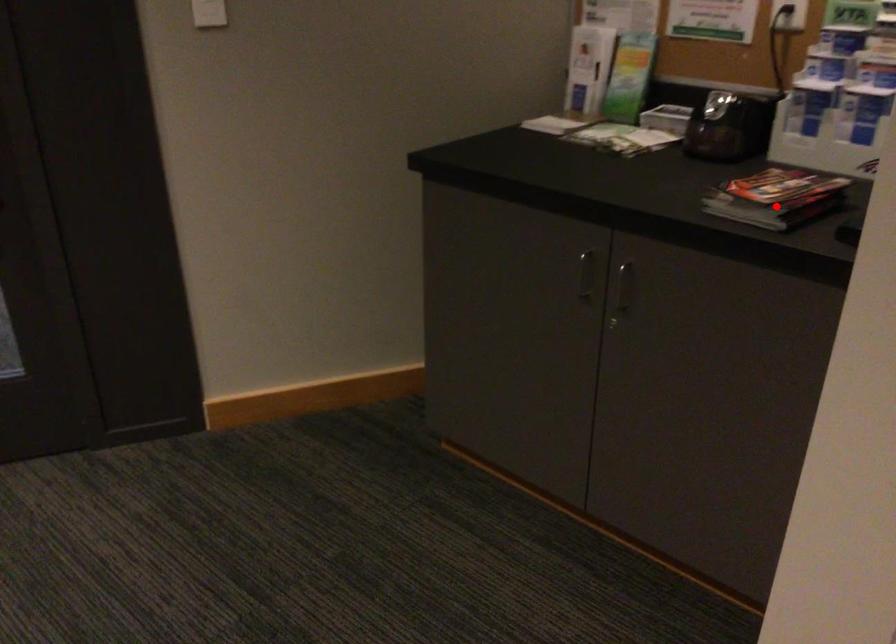
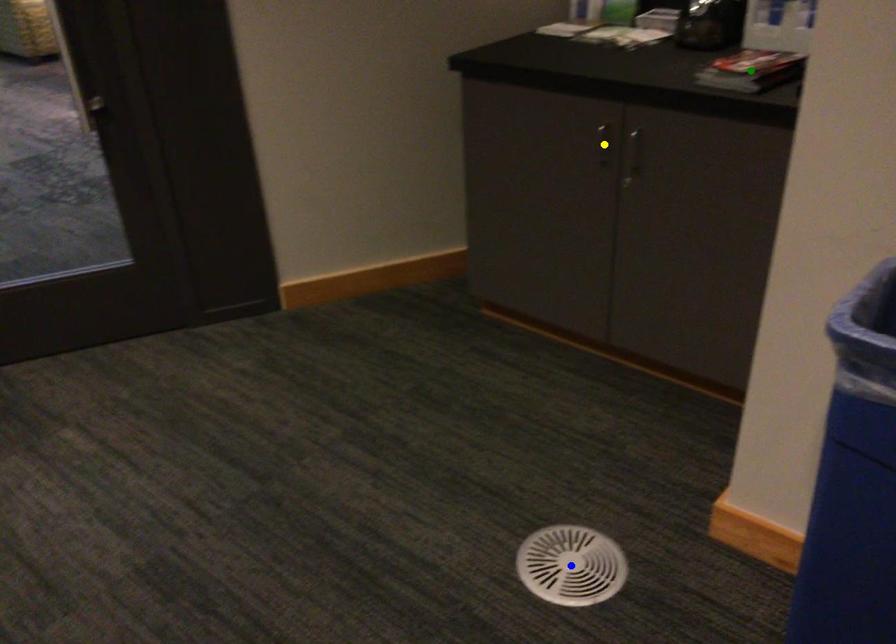
Question: I am providing you with two images of the same scene from different viewpoints. A red point is marked on the first image. You are given multiple points on the second image. Which point in image 2 is actually the same real-world point as the red point in image 1?

Choices:
 (A) blue point
 (B) green point
 (C) yellow point

Answer: (B)